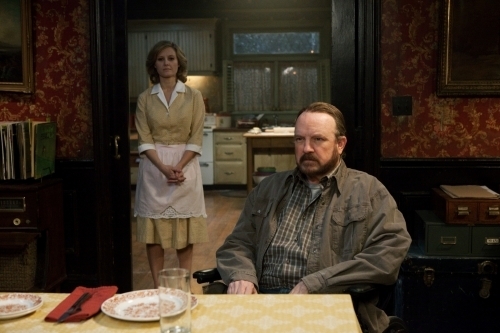
I want to click on plates, so click(x=144, y=306), click(x=27, y=301).